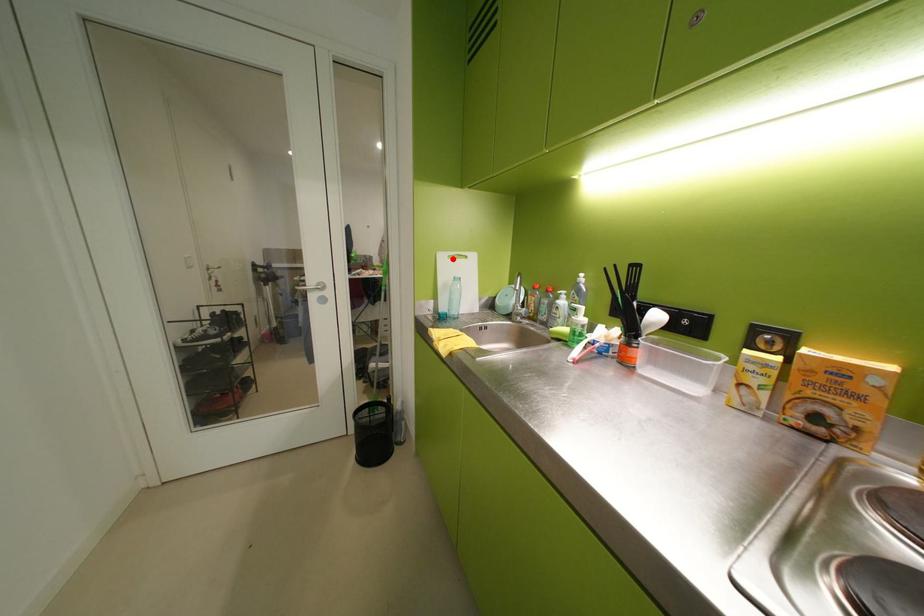
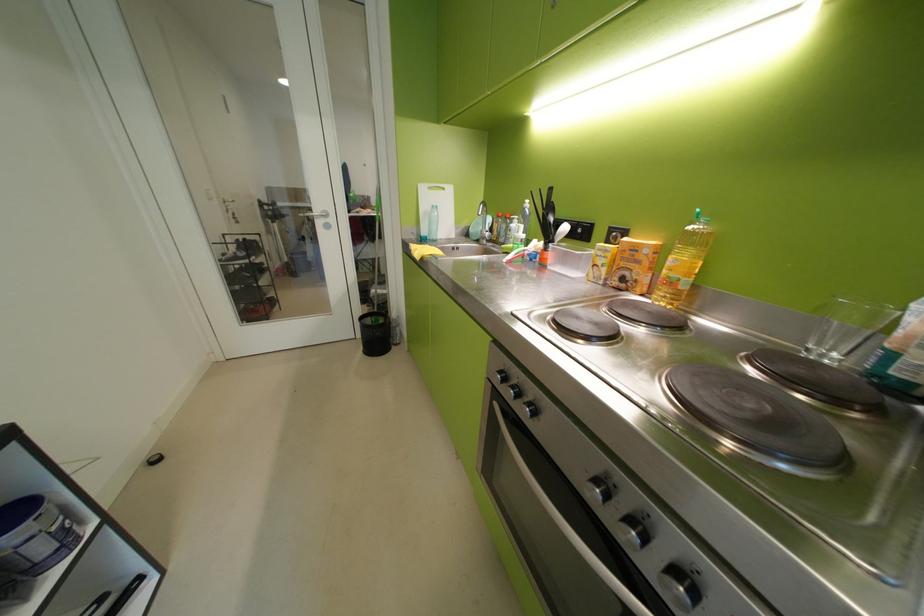
Find the pixel in the second image that matches the highlighted location in the first image.

(433, 190)